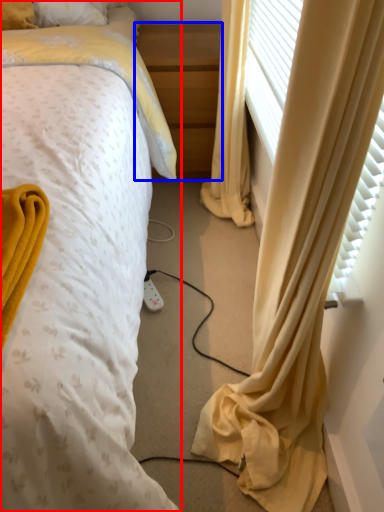
Question: Among these objects, which one is farthest to the camera, bed (highlighted by a red box) or nightstand (highlighted by a blue box)?

Choices:
 (A) bed
 (B) nightstand

Answer: (B)